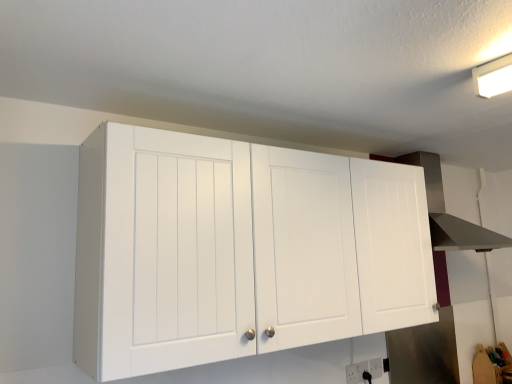
Question: Is white matte cabinet at upper center outside of white plastic electric outlet at lower center, arranged as the 2th electric outlet when viewed from the back?

Choices:
 (A) no
 (B) yes

Answer: (B)

Question: Does white matte cabinet at upper center come in front of white plastic electric outlet at lower center, which ranks as the 1th electric outlet in left-to-right order?

Choices:
 (A) no
 (B) yes

Answer: (B)

Question: Is white matte cabinet at upper center shorter than white plastic electric outlet at lower center, which ranks as the 1th electric outlet in left-to-right order?

Choices:
 (A) yes
 (B) no

Answer: (B)

Question: Can you confirm if white matte cabinet at upper center is thinner than white plastic electric outlet at lower center, positioned as the 2th electric outlet in right-to-left order?

Choices:
 (A) yes
 (B) no

Answer: (B)

Question: From the image's perspective, is white matte cabinet at upper center located beneath white plastic electric outlet at lower center, which ranks as the 1th electric outlet in left-to-right order?

Choices:
 (A) yes
 (B) no

Answer: (B)

Question: In the image, is white plastic electric outlet at lower center, arranged as the first electric outlet when viewed from the right, on the left side or the right side of white matte cabinet at upper center?

Choices:
 (A) right
 (B) left

Answer: (A)

Question: Considering the positions of white plastic electric outlet at lower center, arranged as the first electric outlet when viewed from the right, and white matte cabinet at upper center in the image, is white plastic electric outlet at lower center, arranged as the first electric outlet when viewed from the right, wider or thinner than white matte cabinet at upper center?

Choices:
 (A) wide
 (B) thin

Answer: (B)

Question: From the image's perspective, relative to white matte cabinet at upper center, is white plastic electric outlet at lower center, placed as the first electric outlet when sorted from back to front, above or below?

Choices:
 (A) above
 (B) below

Answer: (B)

Question: From a real-world perspective, relative to white matte cabinet at upper center, is white plastic electric outlet at lower center, arranged as the first electric outlet when viewed from the right, vertically above or below?

Choices:
 (A) below
 (B) above

Answer: (A)

Question: From a real-world perspective, relative to white plastic electric outlet at lower center, the second electric outlet positioned from the left, is stainless steel vent at upper right vertically above or below?

Choices:
 (A) above
 (B) below

Answer: (A)

Question: Choose the correct answer: Is stainless steel vent at upper right inside white plastic electric outlet at lower center, placed as the first electric outlet when sorted from back to front, or outside it?

Choices:
 (A) outside
 (B) inside

Answer: (A)

Question: In the image, is stainless steel vent at upper right on the left side or the right side of white plastic electric outlet at lower center, placed as the first electric outlet when sorted from back to front?

Choices:
 (A) left
 (B) right

Answer: (B)

Question: From the image's perspective, relative to white plastic electric outlet at lower center, placed as the first electric outlet when sorted from back to front, is stainless steel vent at upper right above or below?

Choices:
 (A) below
 (B) above

Answer: (B)

Question: Considering their positions, is white plastic electric outlet at lower center, the second electric outlet positioned from the left, located in front of or behind stainless steel vent at upper right?

Choices:
 (A) front
 (B) behind

Answer: (B)

Question: From the image's perspective, is white plastic electric outlet at lower center, placed as the first electric outlet when sorted from back to front, positioned above or below stainless steel vent at upper right?

Choices:
 (A) above
 (B) below

Answer: (B)